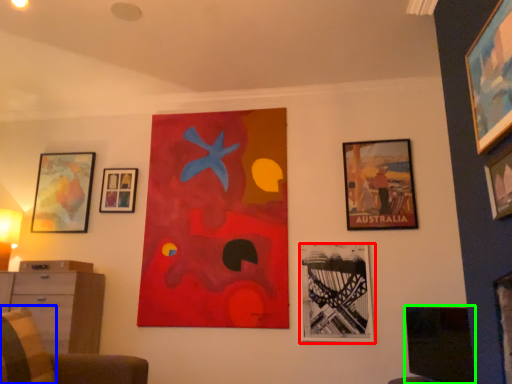
Question: Which is farther away from picture frame (highlighted by a red box)? pillow (highlighted by a blue box) or picture frame (highlighted by a green box)?

Choices:
 (A) pillow
 (B) picture frame

Answer: (A)